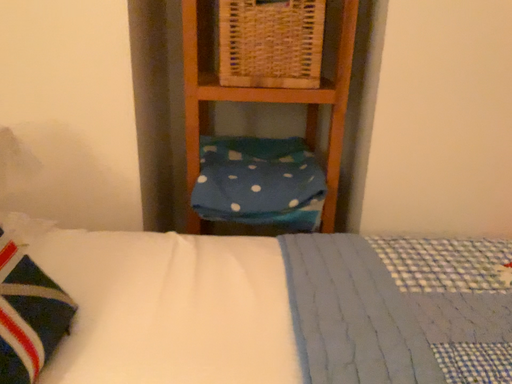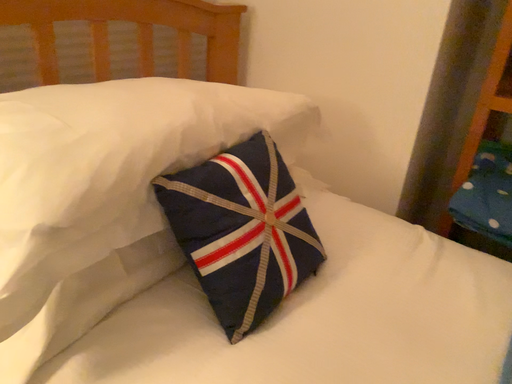
Question: Which way did the camera rotate in the video?

Choices:
 (A) rotated left
 (B) rotated right

Answer: (A)